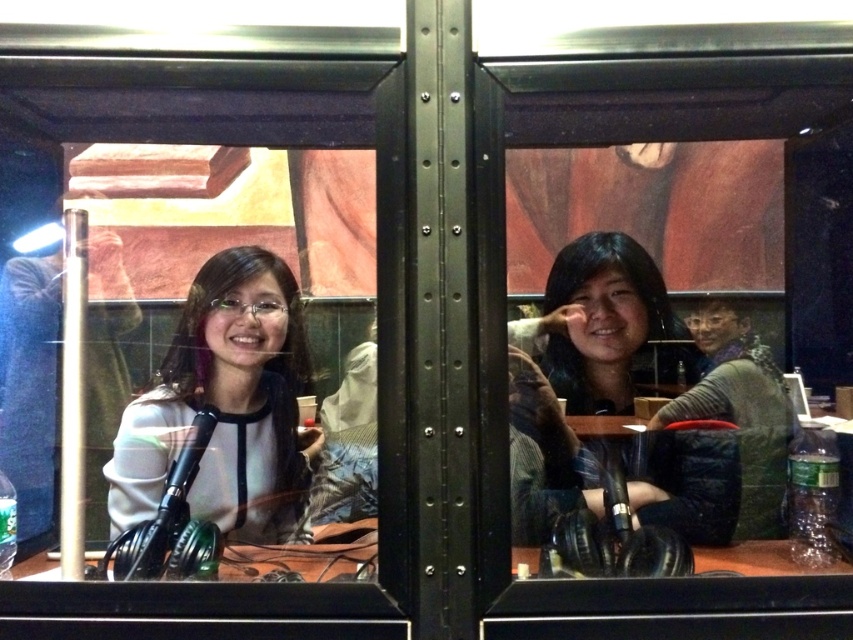
Who is taller, white matte sweater at left or matte black shirt at center?

Standing taller between the two is matte black shirt at center.

Image resolution: width=853 pixels, height=640 pixels. What do you see at coordinates (225, 406) in the screenshot? I see `white matte sweater at left` at bounding box center [225, 406].

Describe the element at coordinates (225, 406) in the screenshot. This screenshot has width=853, height=640. I see `white matte sweater at left` at that location.

Identify the location of white matte sweater at left. (225, 406).